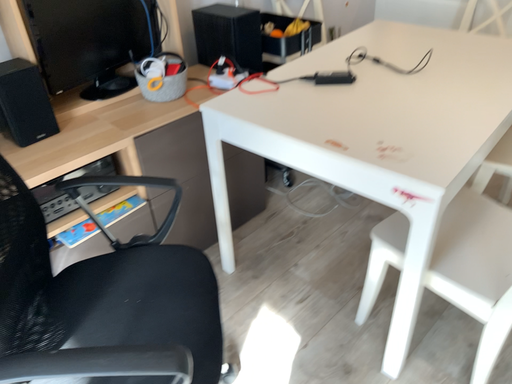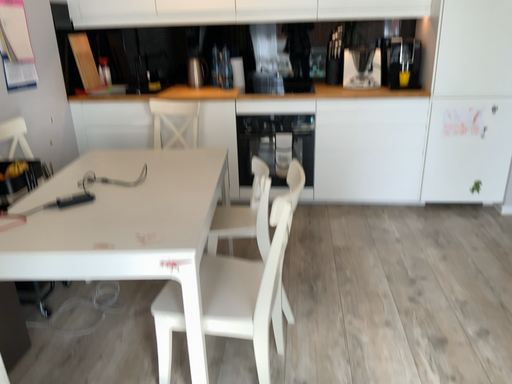
Question: Which way did the camera rotate in the video?

Choices:
 (A) rotated left
 (B) rotated right

Answer: (B)